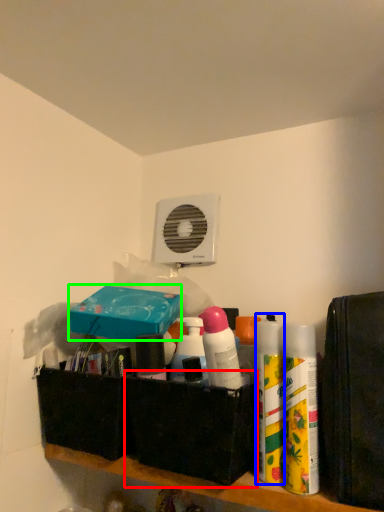
Question: Estimate the real-world distances between objects in this image. Which object is farther from box (highlighted by a red box), cleaning product (highlighted by a blue box) or box (highlighted by a green box)?

Choices:
 (A) cleaning product
 (B) box

Answer: (B)